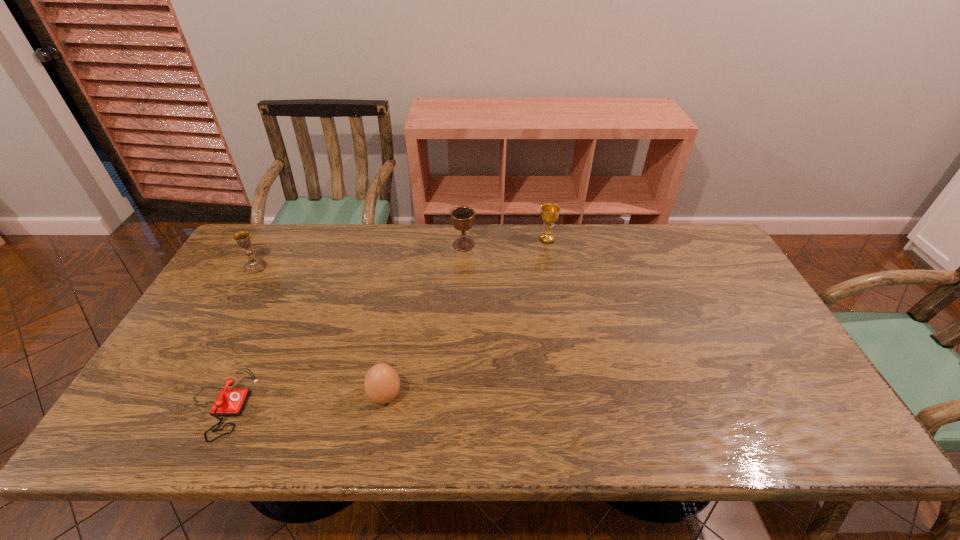
At what (x,y) coordinates should I click in order to perform the action: click on free space at the left edge of the desktop. Please return your answer as a coordinate pair (x, y). This screenshot has width=960, height=540. Looking at the image, I should click on (249, 325).

What are the coordinates of `blank space at the right edge` in the screenshot? It's located at (812, 394).

I want to click on free space at the far right corner, so click(x=699, y=227).

The image size is (960, 540). Identify the location of free space between the third farthest object and the third object from right to left. (320, 331).

This screenshot has height=540, width=960. Identify the location of free spot between the boiled egg and the telephone. (302, 400).

Locate an element on the screen. vacant area between the boiled egg and the second object from right to left is located at coordinates (424, 320).

Where is `vacant area that lies between the telephone and the rightmost chalice`? The image size is (960, 540). vacant area that lies between the telephone and the rightmost chalice is located at coordinates (384, 322).

Locate an element on the screen. unoccupied area between the rightmost chalice and the second chalice from left to right is located at coordinates (505, 242).

This screenshot has height=540, width=960. What are the coordinates of `empty space between the boiled egg and the second chalice from left to right` in the screenshot? It's located at (424, 320).

At what (x,y) coordinates should I click in order to perform the action: click on free spot between the second chalice from right to left and the rightmost chalice. Please return your answer as a coordinate pair (x, y). Looking at the image, I should click on (505, 242).